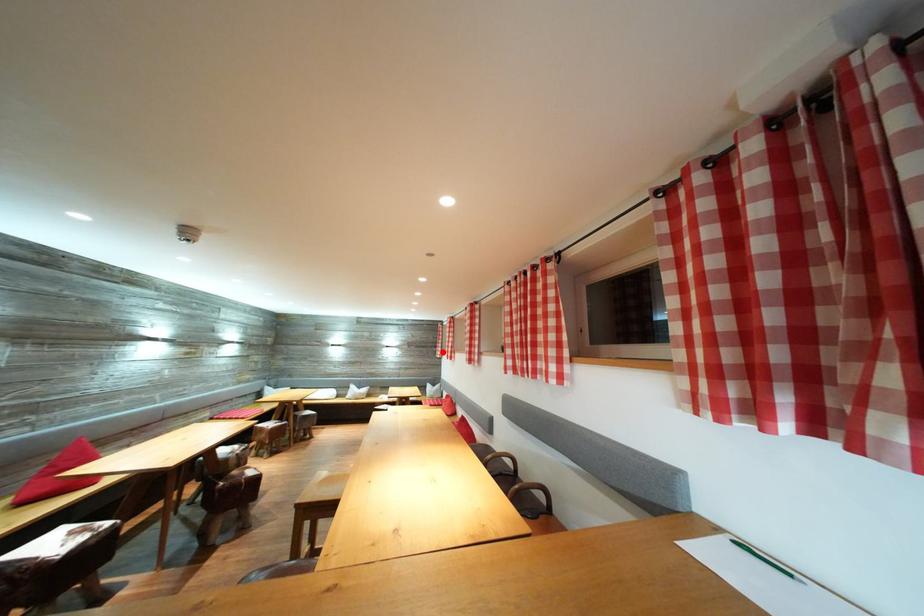
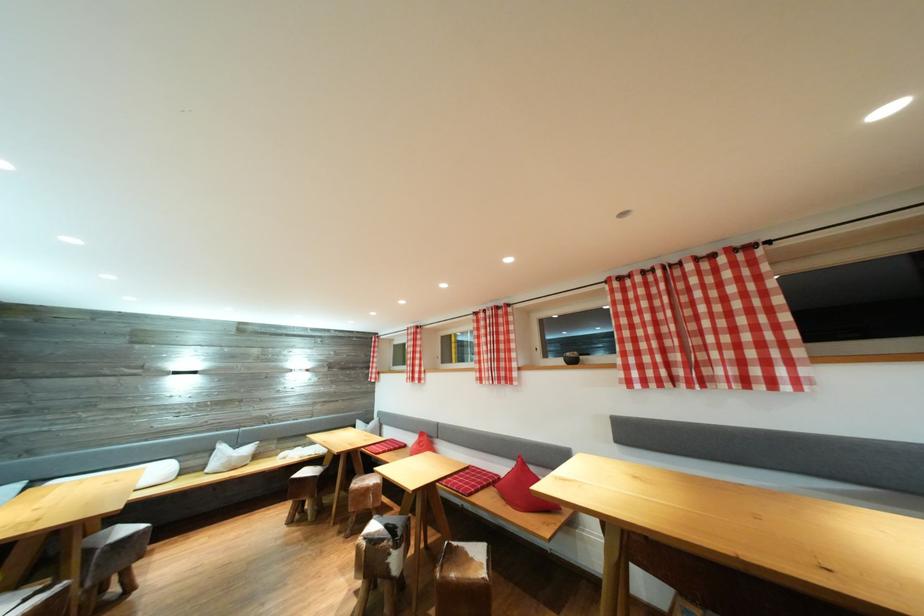
In the second image, find the point that corresponds to the highlighted location in the first image.

(375, 373)